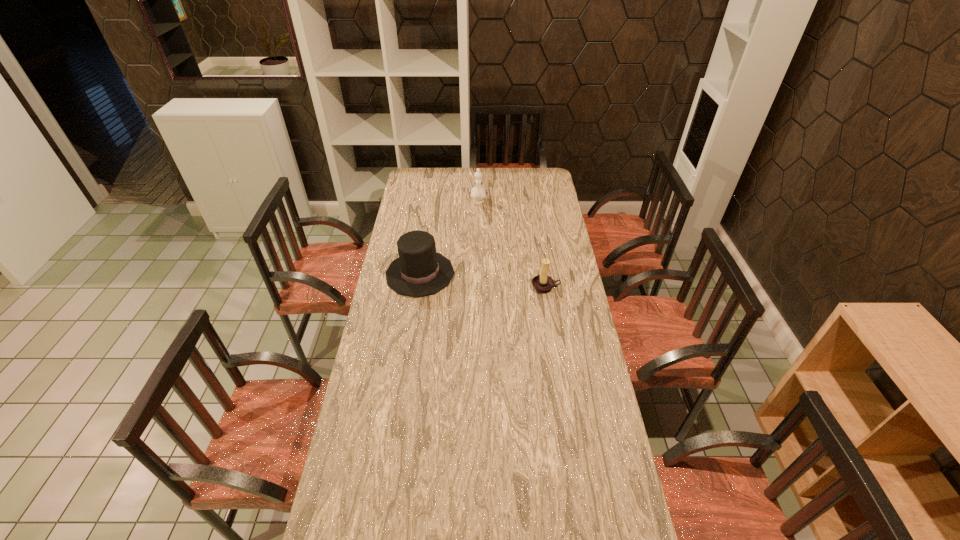
Find the location of a particular element. The image size is (960, 540). the farthest object is located at coordinates (478, 193).

Locate an element on the screen. This screenshot has height=540, width=960. the second object from left to right is located at coordinates (478, 193).

The width and height of the screenshot is (960, 540). What are the coordinates of `the leftmost object` in the screenshot? It's located at (419, 270).

In order to click on candle holder in this screenshot , I will do `click(542, 283)`.

Where is `vacant space located 0.280m at the spout of the chinaware`? vacant space located 0.280m at the spout of the chinaware is located at coordinates click(x=478, y=240).

You are a GUI agent. You are given a task and a screenshot of the screen. Output one action in this format:
    pyautogui.click(x=<x>, y=<y>)
    Task: Click on the vacant area located on the front of the leftmost object with the decoration
    
    Given the screenshot: What is the action you would take?
    pyautogui.click(x=500, y=274)

At what (x,y) coordinates should I click in order to perform the action: click on free space located on the wick of the rightmost object. Please return your answer as a coordinate pair (x, y). The height and width of the screenshot is (540, 960). Looking at the image, I should click on (558, 362).

Where is `object positioned at the left edge`? object positioned at the left edge is located at coordinates (419, 270).

I want to click on object at the right edge, so click(x=542, y=283).

The width and height of the screenshot is (960, 540). I want to click on free space at the far edge of the desktop, so click(x=500, y=181).